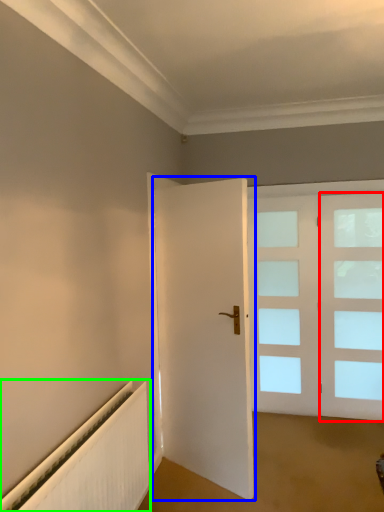
Question: Which object is the closest to the window (highlighted by a red box)? Choose among these: door (highlighted by a blue box) or radiator (highlighted by a green box).

Choices:
 (A) door
 (B) radiator

Answer: (A)